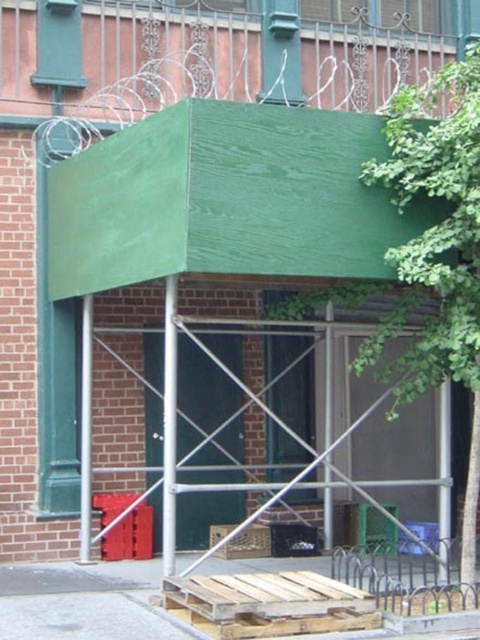
Does green leafy tree at upper center come in front of brown cardboard crate at center?

Yes, green leafy tree at upper center is closer to the viewer.

Measure the distance between green leafy tree at upper center and camera.

The distance of green leafy tree at upper center from camera is 27.79 feet.

Find the location of a particular element. This screenshot has height=640, width=480. green leafy tree at upper center is located at coordinates (429, 259).